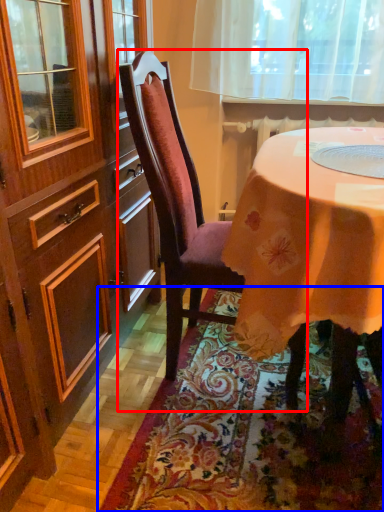
Question: Among these objects, which one is nearest to the camera, chair (highlighted by a red box) or mat (highlighted by a blue box)?

Choices:
 (A) chair
 (B) mat

Answer: (B)